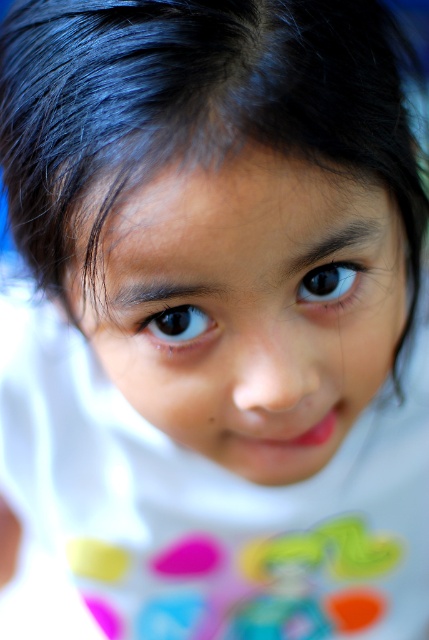
Is smooth skin face at center thinner than brown glossy eye at center?

No.

Is smooth skin face at center taller than brown glossy eye at center?

Indeed, smooth skin face at center has a greater height compared to brown glossy eye at center.

Describe the element at coordinates (244, 305) in the screenshot. This screenshot has height=640, width=429. I see `smooth skin face at center` at that location.

The width and height of the screenshot is (429, 640). What are the coordinates of `smooth skin face at center` in the screenshot? It's located at (244, 305).

Can you confirm if smooth skin face at center is positioned to the right of black glossy eye at center?

In fact, smooth skin face at center is to the left of black glossy eye at center.

Who is shorter, smooth skin face at center or black glossy eye at center?

With less height is black glossy eye at center.

Is point (266, 211) closer to camera compared to point (335, 289)?

Yes, it is in front of point (335, 289).

Find the location of a particular element. This screenshot has width=429, height=640. smooth skin face at center is located at coordinates (244, 305).

Between point (157, 324) and point (299, 300), which one is positioned behind?

The point (299, 300) is behind.

Is brown glossy eye at center shorter than black glossy eye at center?

Correct, brown glossy eye at center is not as tall as black glossy eye at center.

Does point (168, 316) come closer to viewer compared to point (317, 289)?

Yes, point (168, 316) is closer to viewer.

Locate an element on the screen. The image size is (429, 640). brown glossy eye at center is located at coordinates (178, 324).